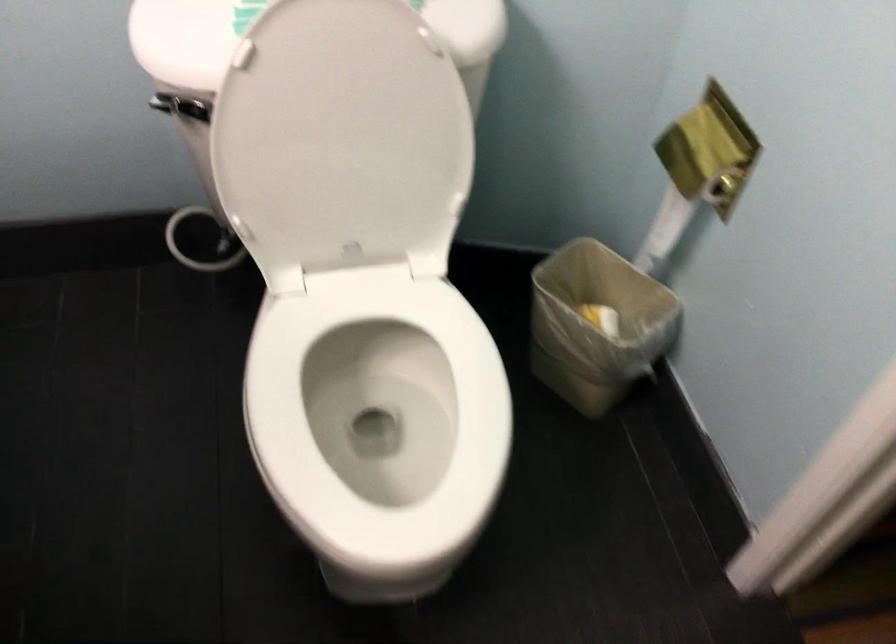
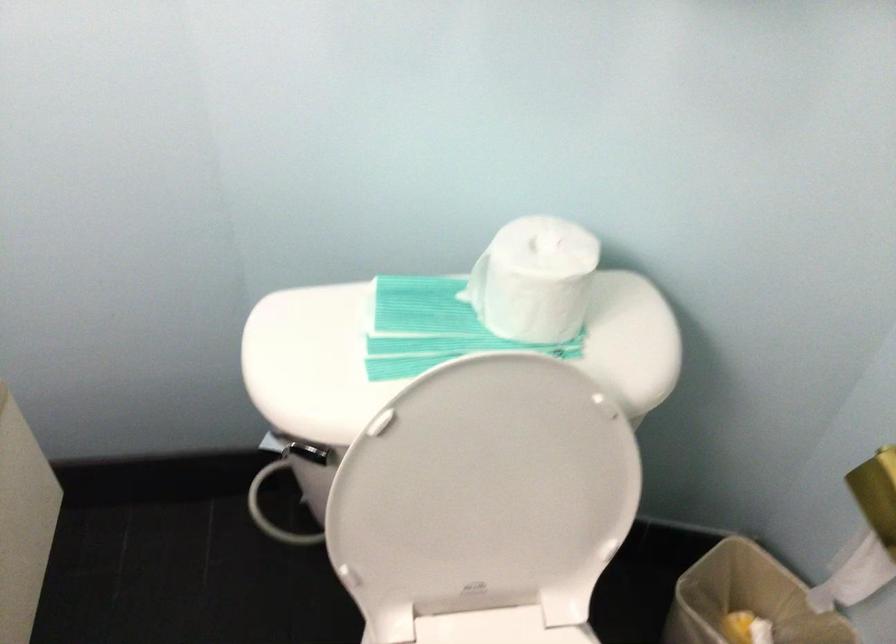
The point at [668,185] is marked in the first image. Where is the corresponding point in the second image?

(866, 534)